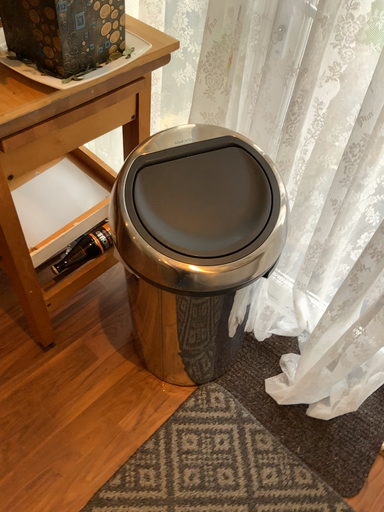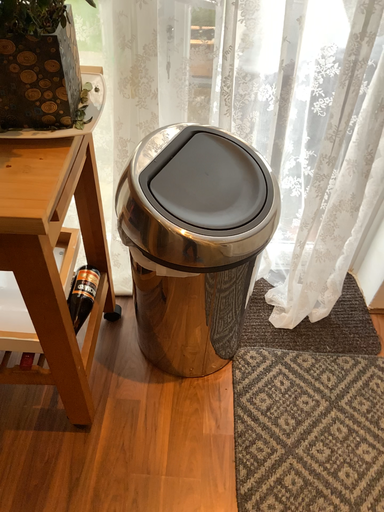
Question: How did the camera likely rotate when shooting the video?

Choices:
 (A) rotated left
 (B) rotated right

Answer: (B)